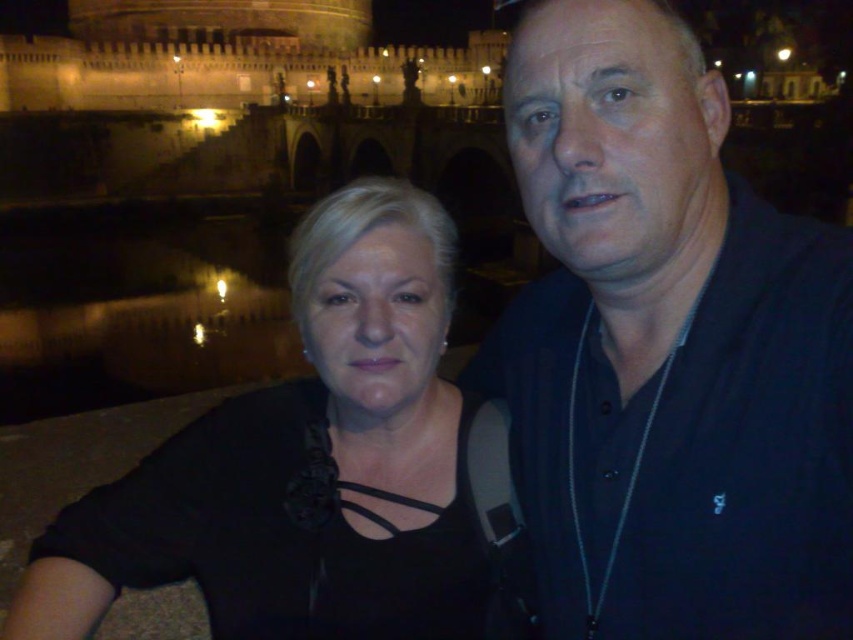
Is dark blue shirt at center wider than black matte shirt at left?

No.

How distant is dark blue shirt at center from black matte shirt at left?

They are 39.80 feet apart.

Which is behind, point (538, 444) or point (360, 348)?

The point (538, 444) is more distant.

Locate an element on the screen. The image size is (853, 640). dark blue shirt at center is located at coordinates (666, 349).